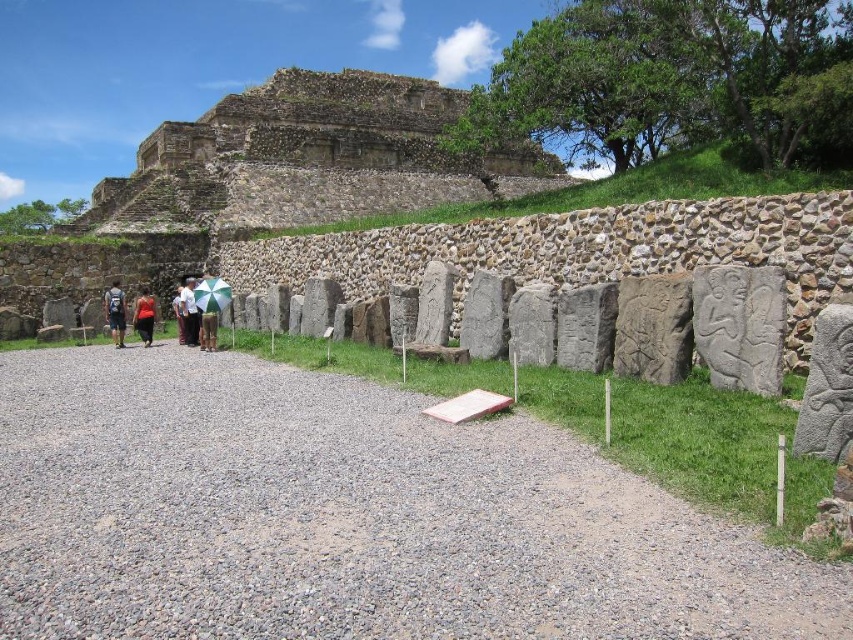
You are standing at the point closest to the pyramid in the archaeological site. Which of the two points, point (106, 294) or point (148, 321), is farther away from you?

Point (106, 294) is behind point (148, 321), so it is farther away from you.